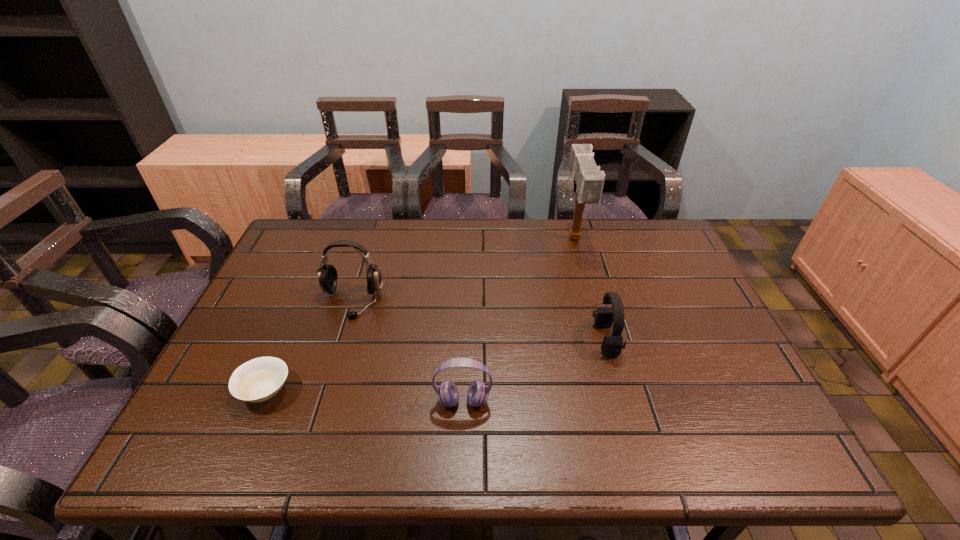
The image size is (960, 540). I want to click on vacant point that satisfies the following two spatial constraints: 1. on the headband of the third nearest object; 2. on the front side of the bowl, so click(x=620, y=390).

This screenshot has width=960, height=540. In order to click on free location that satisfies the following two spatial constraints: 1. on the back side of the tallest object; 2. on the right side of the bowl in this screenshot , I will do click(x=330, y=239).